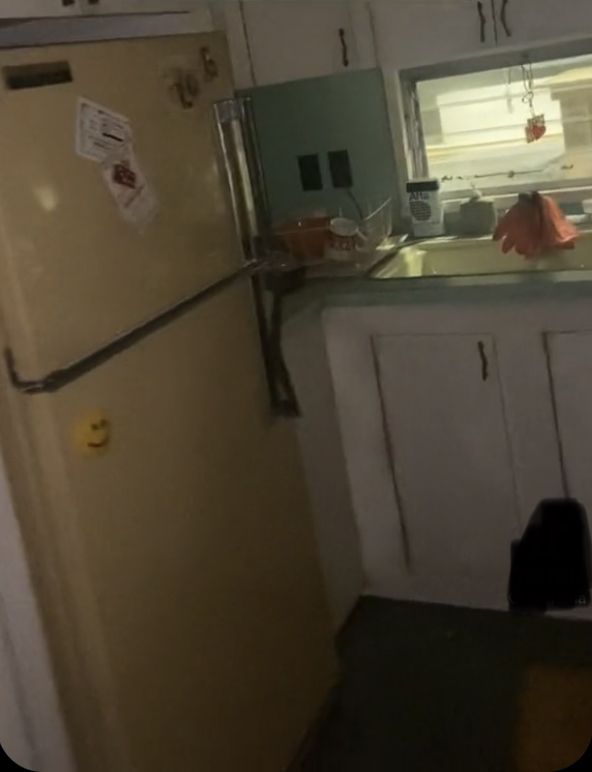
Where is `outlets`? This screenshot has height=772, width=592. outlets is located at coordinates (340, 158), (312, 175).